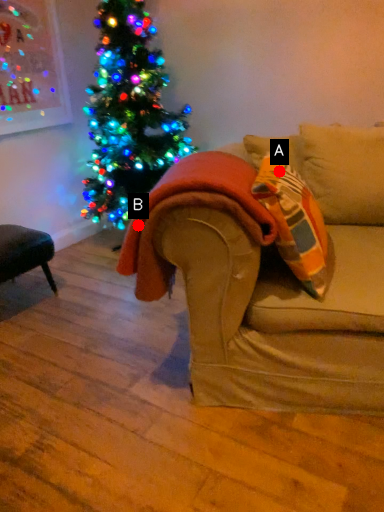
Question: Two points are circled on the image, labeled by A and B beside each circle. Which of the following is the farthest from the observer?

Choices:
 (A) A is further
 (B) B is further

Answer: (A)